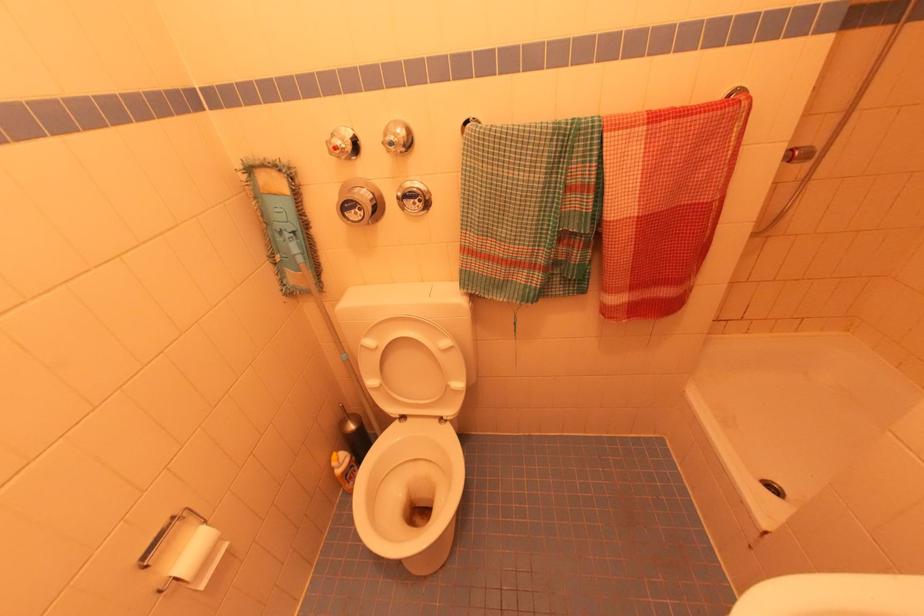
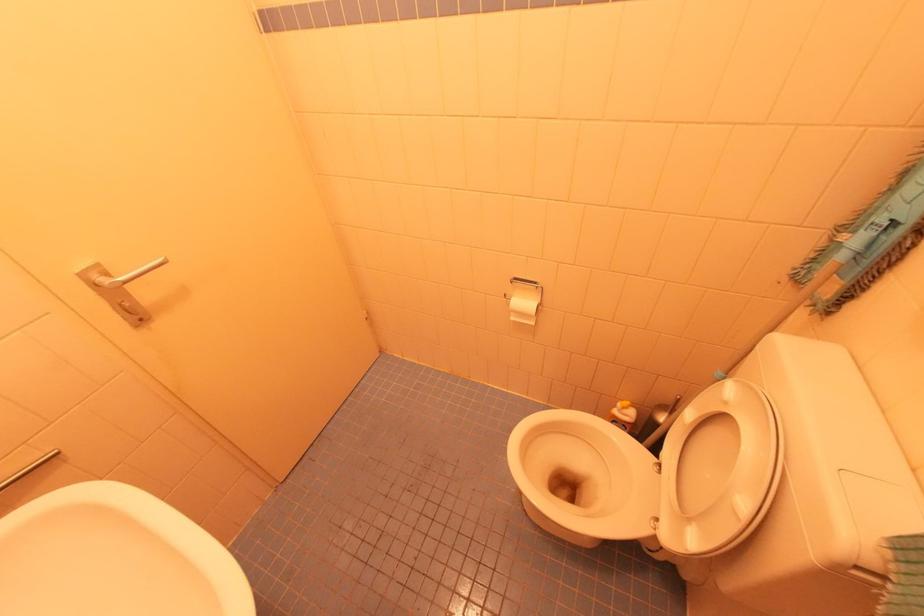
First-person continuous shooting, in which direction is the camera rotating?

The camera rotated toward left-down.